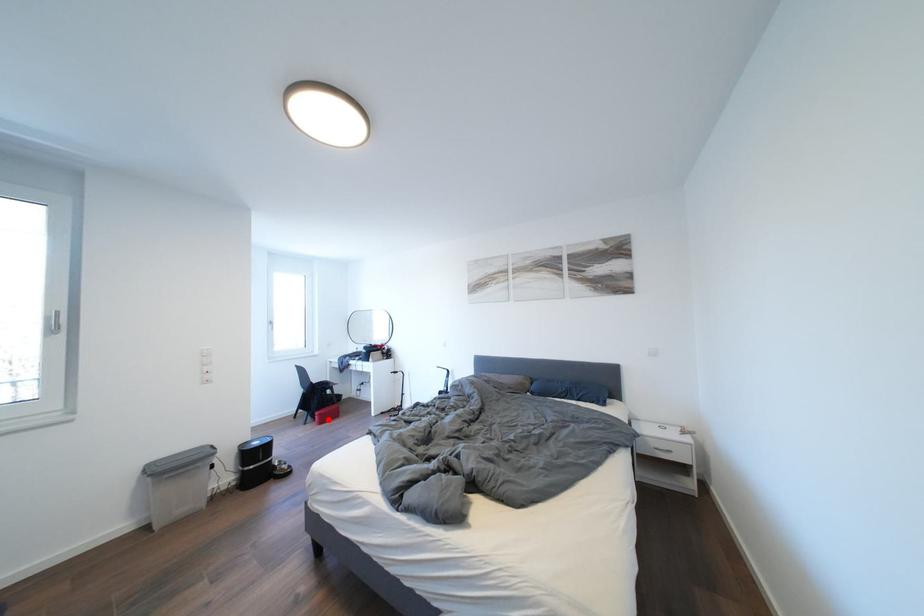
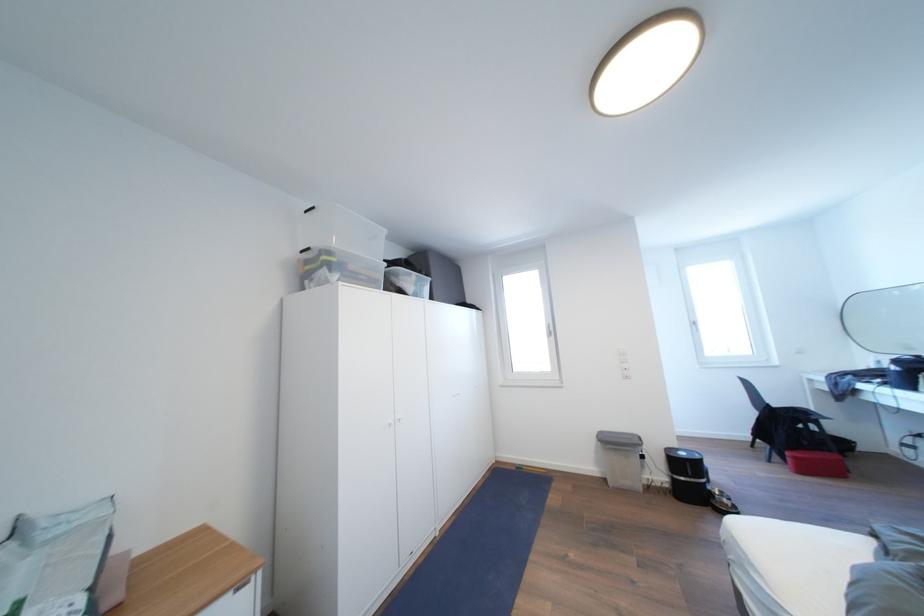
Find the pixel in the second image that matches the highlighted location in the first image.

(803, 463)